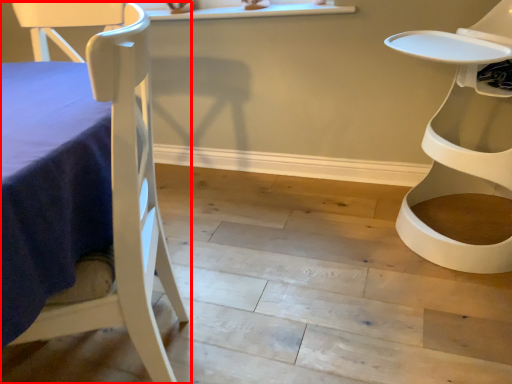
Question: From the image's perspective, what is the correct spatial relationship of chair (annotated by the red box) in relation to chair?

Choices:
 (A) above
 (B) below

Answer: (B)